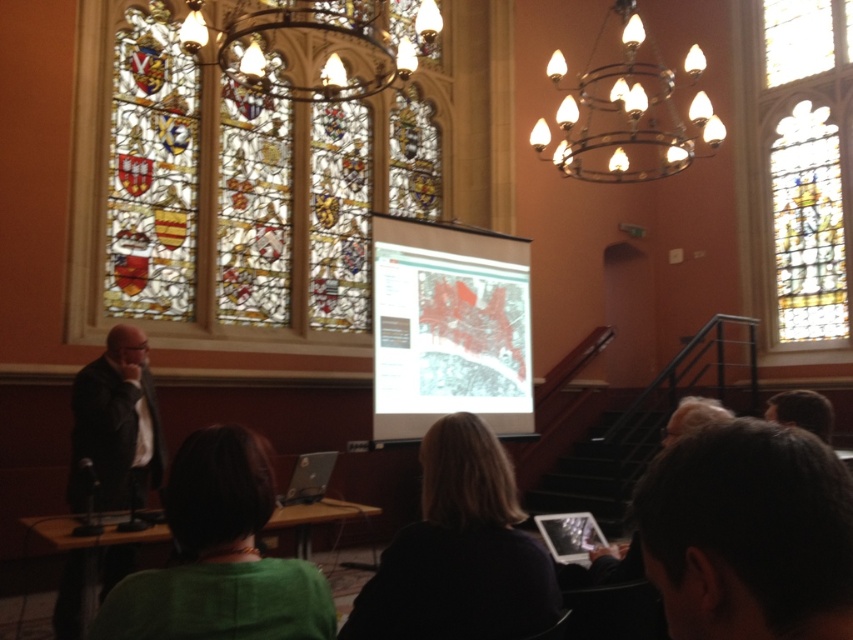
Who is more forward, (517, 513) or (782, 177)?

Point (517, 513)

Who is positioned more to the left, dark brown hair at center or stained glass window at upper right?

dark brown hair at center is more to the left.

Measure the distance between dark brown hair at center and camera.

dark brown hair at center and camera are 5.80 meters apart from each other.

At what (x,y) coordinates should I click in order to perform the action: click on dark brown hair at center. Please return your answer as a coordinate pair (x, y). Image resolution: width=853 pixels, height=640 pixels. Looking at the image, I should click on (459, 552).

Can you confirm if stained glass window at upper right is bigger than metallic wire chandelier at upper center?

No.

Is point (782, 108) positioned in front of point (660, 140)?

That is True.

I want to click on stained glass window at upper right, so click(x=807, y=164).

Is dark brown hair at lower right closer to the viewer compared to gold metallic chandelier at upper center?

Yes, dark brown hair at lower right is closer to the viewer.

Where is `dark brown hair at lower right`? This screenshot has width=853, height=640. dark brown hair at lower right is located at coordinates (747, 532).